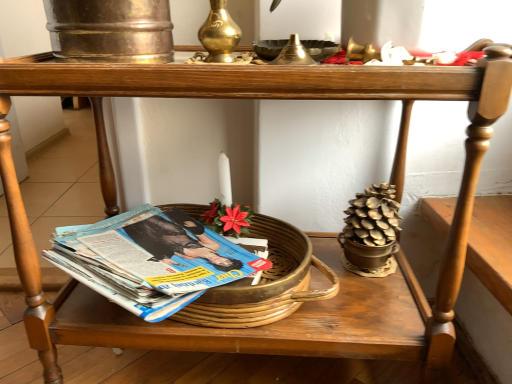
Question: Does point (215, 1) appear closer or farther from the camera than point (310, 51)?

Choices:
 (A) farther
 (B) closer

Answer: (A)

Question: In terms of width, does brass candle holder at upper center, positioned as the 2th candle holder in right-to-left order, look wider or thinner when compared to metallic gold bowl at upper center?

Choices:
 (A) thin
 (B) wide

Answer: (A)

Question: Which of these objects is positioned farthest from the blue glossy magazine at lower left?

Choices:
 (A) metallic gold bowl at upper center
 (B) brass candle holder at upper center, positioned as the 2th candle holder in right-to-left order
 (C) gold metallic candle holder at upper center, acting as the first candle holder starting from the right
 (D) wooden table at lower center

Answer: (C)

Question: Which object is the farthest from the blue glossy magazine at lower left?

Choices:
 (A) brass candle holder at upper center, positioned as the 2th candle holder in right-to-left order
 (B) gold metallic candle holder at upper center, the second candle holder in the left-to-right sequence
 (C) wooden table at lower center
 (D) metallic gold bowl at upper center

Answer: (B)